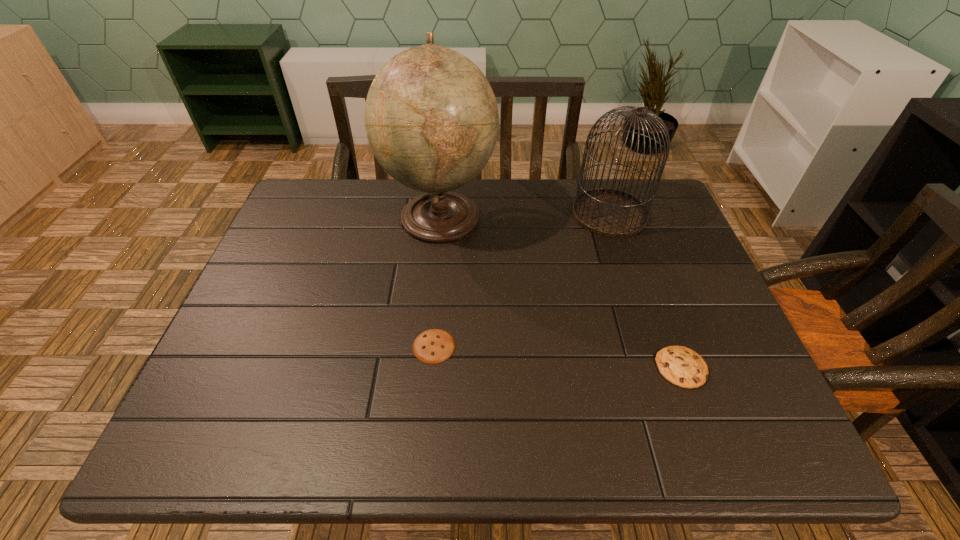
The image size is (960, 540). Identify the location of globe. (431, 117).

Where is `birdcage`? This screenshot has height=540, width=960. birdcage is located at coordinates (611, 213).

At what (x,y) coordinates should I click in order to perform the action: click on the right cookie. Please return your answer as a coordinate pair (x, y). The image size is (960, 540). Looking at the image, I should click on (681, 366).

Image resolution: width=960 pixels, height=540 pixels. What are the coordinates of `the second shortest object` in the screenshot? It's located at (681, 366).

I want to click on the shorter cookie, so click(433, 346).

This screenshot has width=960, height=540. I want to click on the shortest object, so click(x=433, y=346).

Locate an element on the screen. Image resolution: width=960 pixels, height=540 pixels. free region located 0.140m on the front-facing side of the tallest object is located at coordinates (544, 216).

The height and width of the screenshot is (540, 960). Identify the location of vacant space located on the left of the birdcage. (460, 214).

Find the location of a particular element. free space located 0.250m on the left of the taller cookie is located at coordinates (538, 368).

The width and height of the screenshot is (960, 540). In order to click on vacant region located 0.180m on the right of the shortest object in this screenshot , I will do `click(538, 346)`.